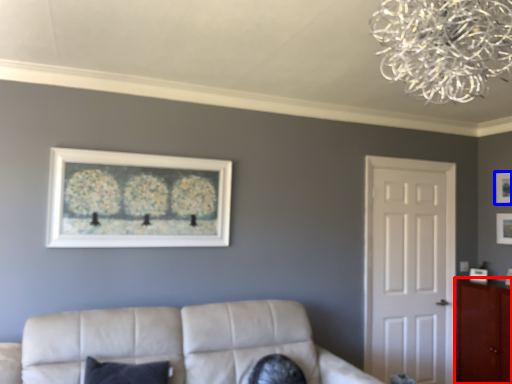
Question: Which object is closer to the camera taking this photo, cabinetry (highlighted by a red box) or picture frame (highlighted by a blue box)?

Choices:
 (A) cabinetry
 (B) picture frame

Answer: (A)